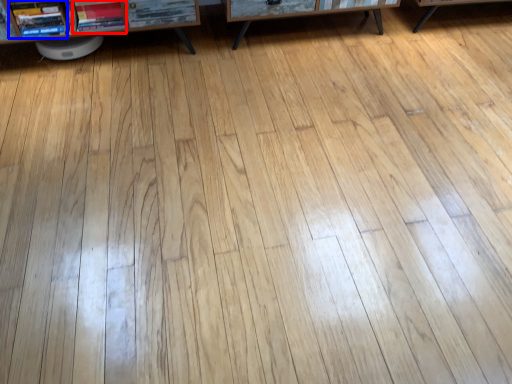
Question: Which object appears closest to the camera in this image, book (highlighted by a red box) or book (highlighted by a blue box)?

Choices:
 (A) book
 (B) book

Answer: (B)